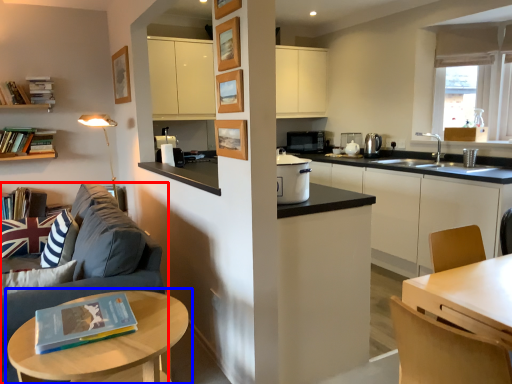
Question: Which object appears farthest to the camera in this image, studio couch (highlighted by a red box) or table (highlighted by a blue box)?

Choices:
 (A) studio couch
 (B) table

Answer: (A)